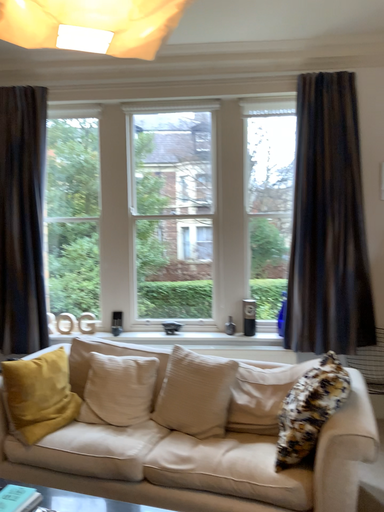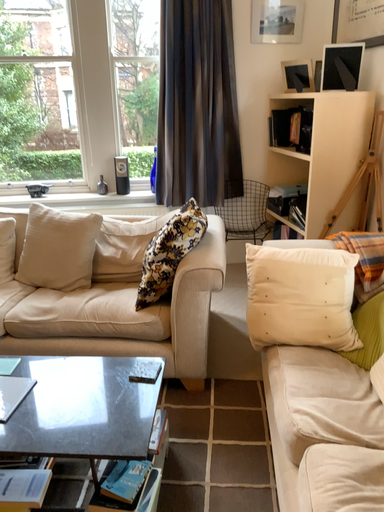
Question: Which way did the camera rotate in the video?

Choices:
 (A) rotated left
 (B) rotated right

Answer: (B)